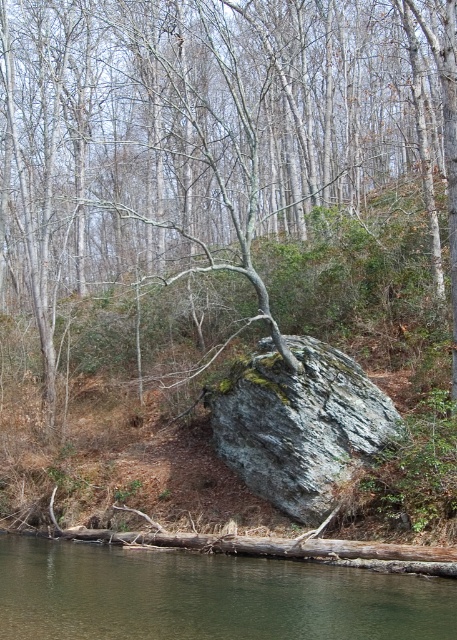
Question: Based on their relative distances, which object is farther from the clear water at lower center?

Choices:
 (A) green mossy rock at center
 (B) gray rough boulder at center

Answer: (A)

Question: Is green mossy rock at center above gray rough boulder at center?

Choices:
 (A) no
 (B) yes

Answer: (B)

Question: Does green mossy rock at center lie in front of gray rough boulder at center?

Choices:
 (A) no
 (B) yes

Answer: (B)

Question: Which of the following is the farthest from the observer?

Choices:
 (A) green mossy rock at center
 (B) clear water at lower center

Answer: (A)

Question: Can you confirm if green mossy rock at center is positioned above gray rough boulder at center?

Choices:
 (A) yes
 (B) no

Answer: (A)

Question: Which point appears closest to the camera in this image?

Choices:
 (A) (233, 401)
 (B) (382, 614)

Answer: (B)